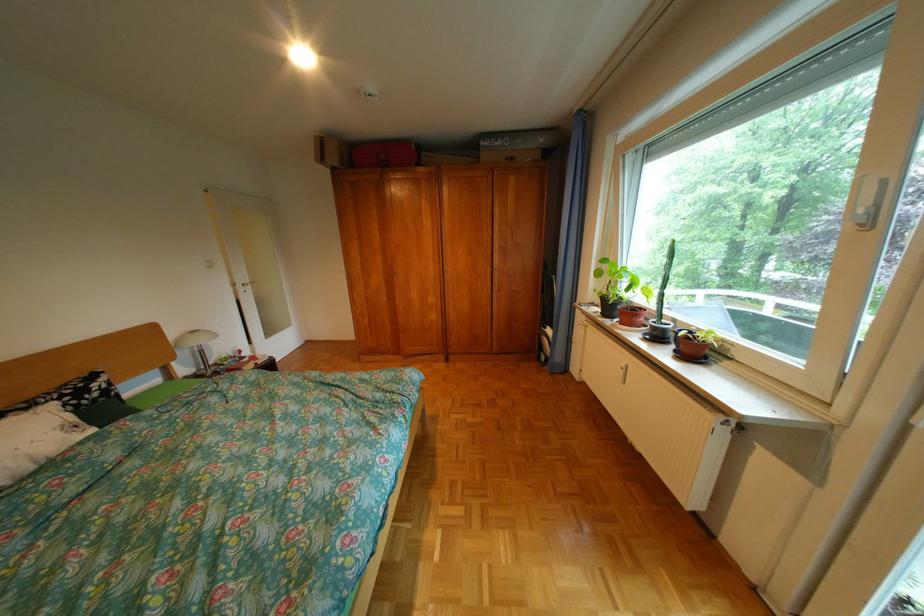
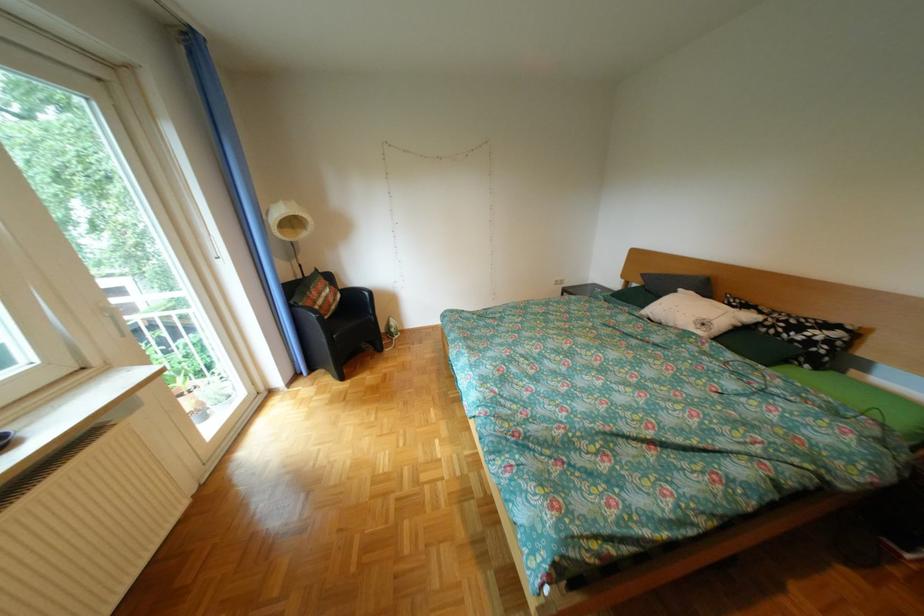
Locate, in the second image, the point that corresponds to [40,408] in the first image.

(775, 313)